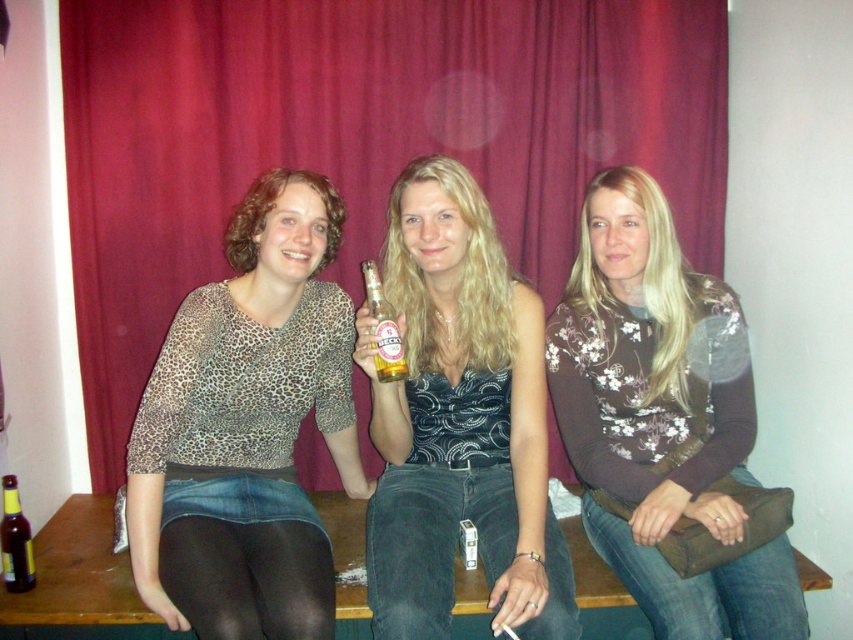
Question: Can you confirm if red velvet curtain at upper center is thinner than brown glass bottle at lower left?

Choices:
 (A) no
 (B) yes

Answer: (A)

Question: Which object appears farthest from the camera in this image?

Choices:
 (A) leopard print blouse at center
 (B) brown floral sweater at center

Answer: (B)

Question: Is brown floral sweater at center wider than translucent glass beer bottle at center?

Choices:
 (A) no
 (B) yes

Answer: (B)

Question: Which object is closer to the camera taking this photo?

Choices:
 (A) brown glass bottle at lower left
 (B) brown floral sweater at center
 (C) shiny silver necklace at center
 (D) leopard print blouse at center

Answer: (C)

Question: Considering the real-world distances, which object is closest to the shiny silver necklace at center?

Choices:
 (A) brown glass bottle at lower left
 (B) translucent glass beer bottle at center
 (C) leopard print blouse at center
 (D) brown floral sweater at center

Answer: (B)

Question: Does shiny silver necklace at center have a smaller size compared to translucent glass beer bottle at center?

Choices:
 (A) no
 (B) yes

Answer: (A)